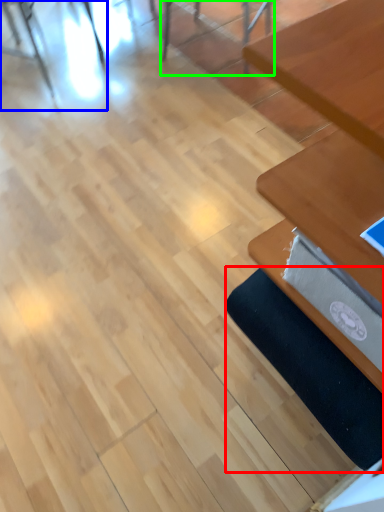
Question: Which object is the farthest from yoga mat (highlighted by a red box)? Choose among these: chair (highlighted by a blue box) or chair (highlighted by a green box).

Choices:
 (A) chair
 (B) chair

Answer: (A)